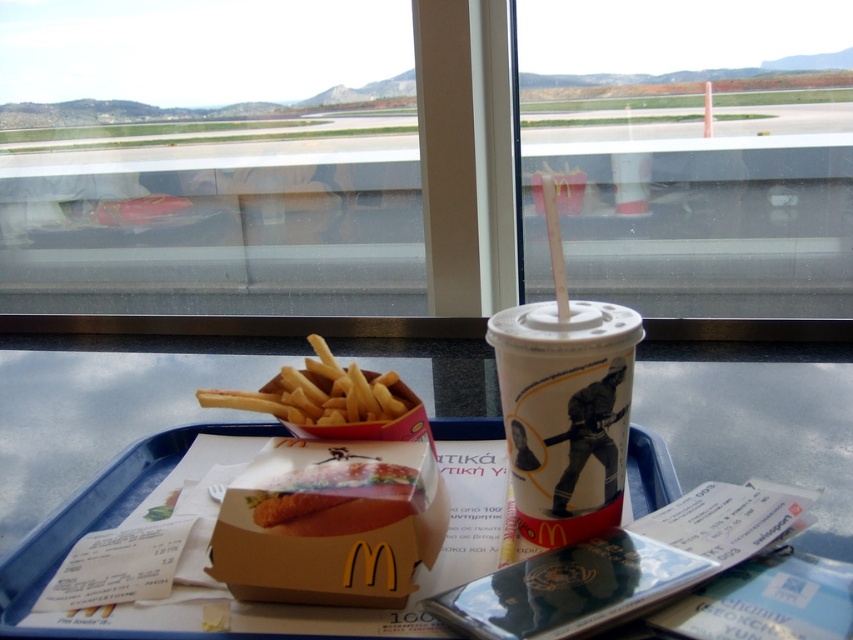
You are a traveler who wants to carry both the transparent plastic cup at center and the blue plastic tray at center in your bag. Considering their shapes, which one is easier to fit into a narrow side pocket?

The transparent plastic cup at center is thinner than the blue plastic tray at center, so it would be easier to fit into a narrow side pocket.

You are at the airport and see a McDonalds meal tray on a table. There is a point at coordinates (x=692, y=160). Which object on the tray is this point located on?

The point at coordinates (x=692, y=160) is located on the transparent plastic cup at center.